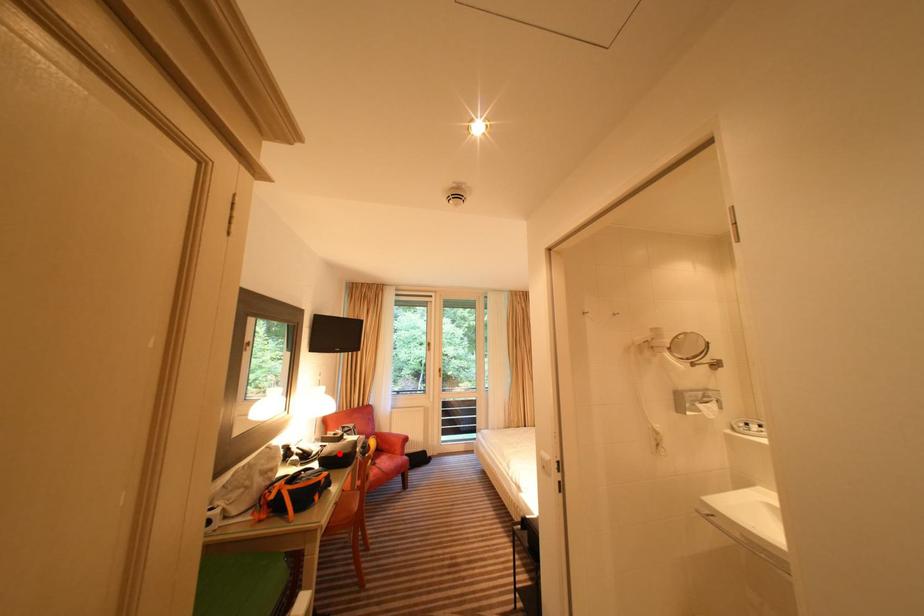
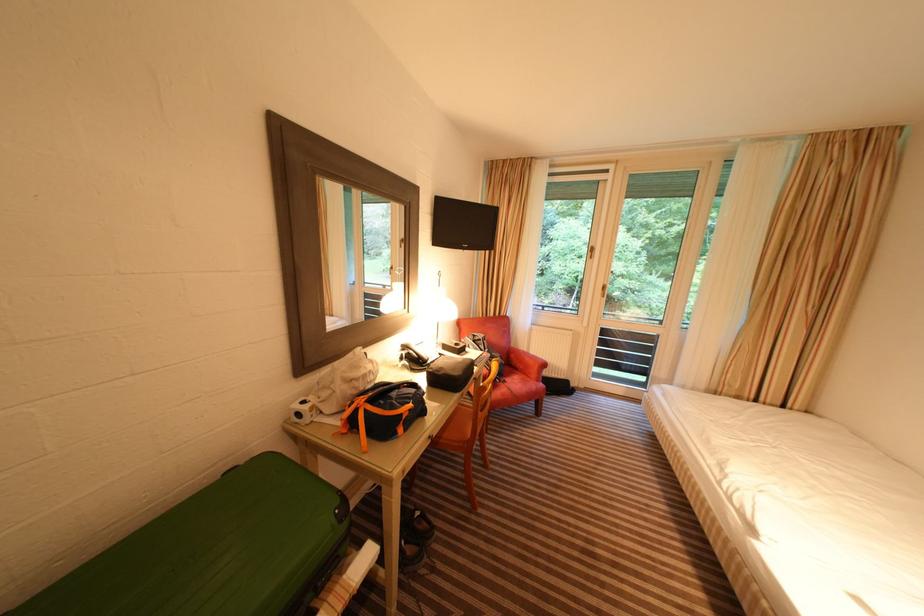
Where in the second image is the point corresponding to the highlighted location from the first image?

(447, 371)